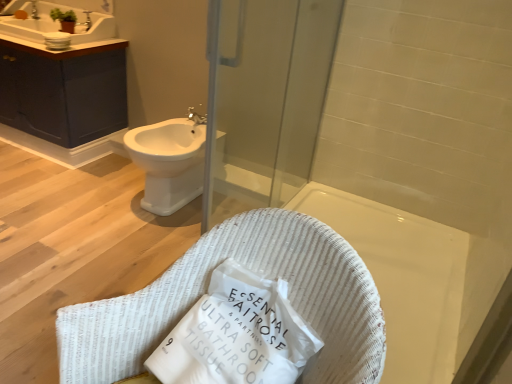
Where is `white glossy bidet at center left`? white glossy bidet at center left is located at coordinates (169, 162).

Find the location of a particular element. The image size is (512, 384). matte dark blue cabinet at upper left is located at coordinates (62, 78).

What is the approximate height of matte dark blue cabinet at upper left?

The height of matte dark blue cabinet at upper left is 24.11 inches.

Where is `silver metallic faucet at upper left, positioned as the second faucet in bottom-to-top order`? silver metallic faucet at upper left, positioned as the second faucet in bottom-to-top order is located at coordinates (34, 10).

What is the approximate height of silver metallic faucet at upper left, marked as the first faucet in a front-to-back arrangement?

The height of silver metallic faucet at upper left, marked as the first faucet in a front-to-back arrangement, is 4.86 inches.

Where is `white glossy sink at upper left`? The image size is (512, 384). white glossy sink at upper left is located at coordinates (59, 25).

This screenshot has height=384, width=512. In order to click on white woven basket at center in this screenshot , I will do `click(257, 274)`.

Where is `white paper tissue at center`? white paper tissue at center is located at coordinates (237, 334).

Is silver metallic faucet at upper left, marked as the first faucet in a front-to-back arrangement, taller or shorter than white glossy bidet at center left?

Considering their sizes, silver metallic faucet at upper left, marked as the first faucet in a front-to-back arrangement, has less height than white glossy bidet at center left.

Is silver metallic faucet at upper left, arranged as the 2th faucet when viewed from the back, oriented towards white glossy bidet at center left?

No, silver metallic faucet at upper left, arranged as the 2th faucet when viewed from the back, is not facing towards white glossy bidet at center left.

Which of these two, silver metallic faucet at upper left, marked as the first faucet in a front-to-back arrangement, or white glossy bidet at center left, is smaller?

silver metallic faucet at upper left, marked as the first faucet in a front-to-back arrangement.

Is white glossy sink at upper left at the back of white paper tissue at center?

No.

Can you confirm if white paper tissue at center is positioned to the right of white glossy sink at upper left?

Yes, white paper tissue at center is to the right of white glossy sink at upper left.

Does point (283, 332) appear closer or farther from the camera than point (109, 23)?

Point (283, 332) appears to be closer to the viewer than point (109, 23).

Based on the photo, does matte dark blue cabinet at upper left have a greater width compared to white glossy sink at upper left?

Yes, matte dark blue cabinet at upper left is wider than white glossy sink at upper left.

Is matte dark blue cabinet at upper left directly adjacent to white glossy sink at upper left?

There is a gap between matte dark blue cabinet at upper left and white glossy sink at upper left.

Find the location of `bathroom cabinet in front of the white glossy sink at upper left`. bathroom cabinet in front of the white glossy sink at upper left is located at coordinates (62, 78).

Considering the points (21, 101) and (92, 14), which point is in front, point (21, 101) or point (92, 14)?

Point (21, 101)

I want to click on sink that appears on the left of silver metallic faucet at upper left, marked as the first faucet in a front-to-back arrangement, so click(x=59, y=25).

Which of these two, silver metallic faucet at upper left, positioned as the second faucet in top-to-bottom order, or white glossy sink at upper left, stands taller?

With more height is white glossy sink at upper left.

Would you say silver metallic faucet at upper left, positioned as the second faucet in top-to-bottom order, is inside or outside white glossy sink at upper left?

The correct answer is: inside.

Considering the relative sizes of silver metallic faucet at upper left, the first faucet viewed from the right, and white glossy sink at upper left in the image provided, is silver metallic faucet at upper left, the first faucet viewed from the right, smaller than white glossy sink at upper left?

Correct, silver metallic faucet at upper left, the first faucet viewed from the right, occupies less space than white glossy sink at upper left.

Locate an element on the screen. faucet in front of the silver metallic faucet at upper left, which is the second faucet from front to back is located at coordinates (87, 21).

Considering the positions of points (82, 23) and (32, 0), is point (82, 23) closer to camera compared to point (32, 0)?

Yes.

Is silver metallic faucet at upper left, marked as the first faucet in a front-to-back arrangement, positioned before silver metallic faucet at upper left, the first faucet positioned from the back?

Yes, the depth of silver metallic faucet at upper left, marked as the first faucet in a front-to-back arrangement, is less than that of silver metallic faucet at upper left, the first faucet positioned from the back.

Considering the sizes of objects silver metallic faucet at upper left, which appears as the second faucet when viewed from the left, and silver metallic faucet at upper left, placed as the first faucet when sorted from top to bottom, in the image provided, who is taller, silver metallic faucet at upper left, which appears as the second faucet when viewed from the left, or silver metallic faucet at upper left, placed as the first faucet when sorted from top to bottom,?

With more height is silver metallic faucet at upper left, which appears as the second faucet when viewed from the left.

Is point (87, 14) closer or farther from the camera than point (245, 126)?

Point (87, 14) is farther from the camera than point (245, 126).

Can you confirm if silver metallic faucet at upper left, which appears as the second faucet when viewed from the left, is positioned to the left of transparent glass screen door at upper center?

Yes.

From a real-world perspective, is silver metallic faucet at upper left, the first faucet from the bottom, over transparent glass screen door at upper center?

Correct, in the physical world, silver metallic faucet at upper left, the first faucet from the bottom, is higher than transparent glass screen door at upper center.

Relative to transparent glass screen door at upper center, is silver metallic faucet at upper left, marked as the first faucet in a front-to-back arrangement, in front or behind?

silver metallic faucet at upper left, marked as the first faucet in a front-to-back arrangement, is behind transparent glass screen door at upper center.

Is silver metallic faucet at upper left, positioned as the second faucet in bottom-to-top order, facing away from matte dark blue cabinet at upper left?

No, silver metallic faucet at upper left, positioned as the second faucet in bottom-to-top order,'s orientation is not away from matte dark blue cabinet at upper left.

From the image's perspective, who appears lower, silver metallic faucet at upper left, which is the second faucet from front to back, or matte dark blue cabinet at upper left?

From the image's view, matte dark blue cabinet at upper left is below.

Does silver metallic faucet at upper left, which is the second faucet from front to back, have a greater width compared to matte dark blue cabinet at upper left?

No, silver metallic faucet at upper left, which is the second faucet from front to back, is not wider than matte dark blue cabinet at upper left.

Between silver metallic faucet at upper left, which is counted as the first faucet, starting from the left, and matte dark blue cabinet at upper left, which one has smaller size?

silver metallic faucet at upper left, which is counted as the first faucet, starting from the left.

Where is `bidet to the right of silver metallic faucet at upper left, the first faucet viewed from the right`? bidet to the right of silver metallic faucet at upper left, the first faucet viewed from the right is located at coordinates (169, 162).

Identify the location of material below the white glossy sink at upper left (from a real-world perspective). The width and height of the screenshot is (512, 384). (237, 334).

Which object lies further to the anchor point white woven basket at center, transparent glass screen door at upper center or silver metallic faucet at upper left, the first faucet from the bottom?

silver metallic faucet at upper left, the first faucet from the bottom, is further to white woven basket at center.

Which object lies nearer to the anchor point white woven basket at center, white paper tissue at center or silver metallic faucet at upper left, the first faucet viewed from the right?

Based on the image, white paper tissue at center appears to be nearer to white woven basket at center.

Estimate the real-world distances between objects in this image. Which object is further from silver metallic faucet at upper left, positioned as the second faucet in top-to-bottom order, matte dark blue cabinet at upper left or white paper tissue at center?

Based on the image, white paper tissue at center appears to be further to silver metallic faucet at upper left, positioned as the second faucet in top-to-bottom order.

Based on their spatial positions, is white glossy bidet at center left or transparent glass screen door at upper center further from white woven basket at center?

transparent glass screen door at upper center lies further to white woven basket at center than the other object.

From the image, which object appears to be farther from transparent glass screen door at upper center, matte dark blue cabinet at upper left or white glossy sink at upper left?

white glossy sink at upper left lies further to transparent glass screen door at upper center than the other object.

When comparing their distances from white woven basket at center, does white glossy sink at upper left or matte dark blue cabinet at upper left seem further?

Among the two, white glossy sink at upper left is located further to white woven basket at center.

Which object lies nearer to the anchor point white paper tissue at center, silver metallic faucet at upper left, which appears as the second faucet when viewed from the left, or white woven basket at center?

Based on the image, white woven basket at center appears to be nearer to white paper tissue at center.

From the picture: From the image, which object appears to be farther from white paper tissue at center, matte dark blue cabinet at upper left or silver metallic faucet at upper left, which appears as the second faucet when viewed from the left?

silver metallic faucet at upper left, which appears as the second faucet when viewed from the left, is further to white paper tissue at center.

Where is `screen door located between white woven basket at center and white glossy bidet at center left in the depth direction`? The height and width of the screenshot is (384, 512). screen door located between white woven basket at center and white glossy bidet at center left in the depth direction is located at coordinates (264, 100).

Where is `screen door between white paper tissue at center and white glossy sink at upper left from front to back`? This screenshot has width=512, height=384. screen door between white paper tissue at center and white glossy sink at upper left from front to back is located at coordinates (264, 100).

You are a GUI agent. You are given a task and a screenshot of the screen. Output one action in this format:
    pyautogui.click(x=<x>, y=<y>)
    Task: Click on the bidet between white woven basket at center and silver metallic faucet at upper left, which is the second faucet from front to back, from front to back
    The height and width of the screenshot is (384, 512).
    Given the screenshot: What is the action you would take?
    pyautogui.click(x=169, y=162)

You are a GUI agent. You are given a task and a screenshot of the screen. Output one action in this format:
    pyautogui.click(x=<x>, y=<y>)
    Task: Click on the screen door positioned between white woven basket at center and silver metallic faucet at upper left, positioned as the second faucet in bottom-to-top order, from near to far
    This screenshot has width=512, height=384.
    Given the screenshot: What is the action you would take?
    pyautogui.click(x=264, y=100)